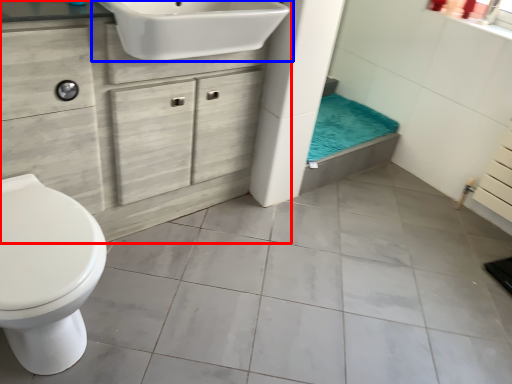
Question: Among these objects, which one is farthest to the camera, bathroom cabinet (highlighted by a red box) or sink (highlighted by a blue box)?

Choices:
 (A) bathroom cabinet
 (B) sink

Answer: (B)